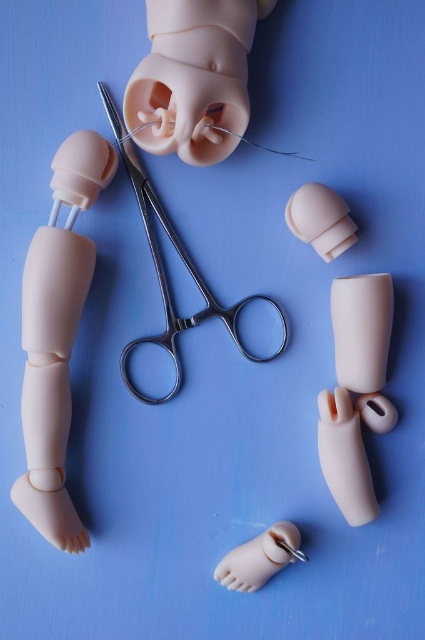
You are an artist creating a sculpture and need to place two markers at the points labeled point (61, 163) and point (294, 556). Which point should you place first if you want to start with the one closer to you?

You should place the marker at point (61, 163) first because it is closer to the viewer than point (294, 556).

You are a toy repair technician and need to reattach the matte plastic hand at center and the matte plastic foot at lower center to a doll. Which object should you attach first based on their current positions?

The matte plastic hand at center should be attached first because it is located above the matte plastic foot at lower center, making it more accessible from the top.

Looking at this image, you are an artist creating a 3D model of the scene. You need to determine which of the two points, point (206, 10) or point (325, 218), is closer to the viewer. Which one is closer?

Point (206, 10) is closer to the viewer than point (325, 218).